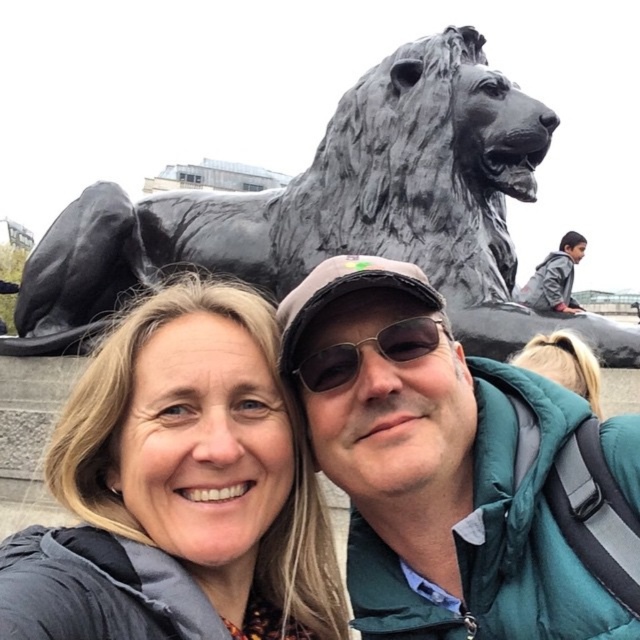
Can you confirm if matte black jacket at center is thinner than sunglasses at center?

No.

What do you see at coordinates (460, 468) in the screenshot? I see `matte black jacket at center` at bounding box center [460, 468].

Locate an element on the screen. This screenshot has height=640, width=640. matte black jacket at center is located at coordinates (460, 468).

Is sunglasses at center further to camera compared to green puffy jacket at center?

That is False.

Can you confirm if sunglasses at center is taller than green puffy jacket at center?

In fact, sunglasses at center may be shorter than green puffy jacket at center.

The image size is (640, 640). Find the location of `sunglasses at center`. sunglasses at center is located at coordinates (372, 346).

Looking at this image, does black polished stone lion at upper center appear under green puffy jacket at center?

No, black polished stone lion at upper center is not below green puffy jacket at center.

Can you confirm if black polished stone lion at upper center is positioned to the right of green puffy jacket at center?

No, black polished stone lion at upper center is not to the right of green puffy jacket at center.

Which is behind, point (451, 148) or point (545, 372)?

Positioned behind is point (451, 148).

You are a GUI agent. You are given a task and a screenshot of the screen. Output one action in this format:
    pyautogui.click(x=<x>, y=<y>)
    Task: Click on the black polished stone lion at upper center
    
    Given the screenshot: What is the action you would take?
    pyautogui.click(x=324, y=209)